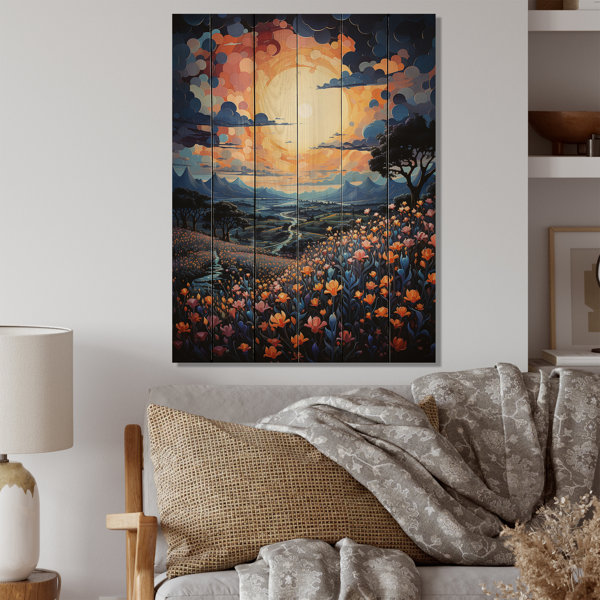
Where is `white wall`? The image size is (600, 600). white wall is located at coordinates (77, 37), (498, 318), (128, 333).